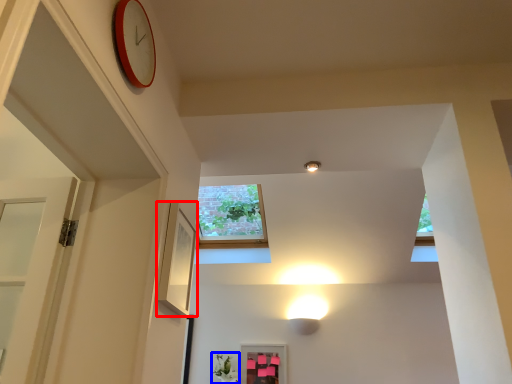
Question: Among these objects, which one is farthest to the camera, picture frame (highlighted by a red box) or plant (highlighted by a blue box)?

Choices:
 (A) picture frame
 (B) plant

Answer: (B)